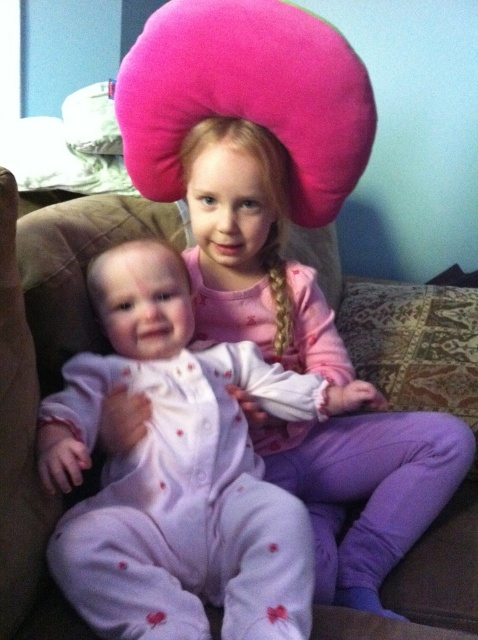
Question: Which point is farther to the camera?

Choices:
 (A) (125, 512)
 (B) (417, 416)

Answer: (B)

Question: Is matte pink pajamas at center above pink soft pajamas at center?

Choices:
 (A) no
 (B) yes

Answer: (A)

Question: Where is matte pink pajamas at center located in relation to pink soft pajamas at center in the image?

Choices:
 (A) below
 (B) above

Answer: (A)

Question: From the image, what is the correct spatial relationship of matte pink pajamas at center in relation to pink soft pajamas at center?

Choices:
 (A) left
 (B) right

Answer: (A)

Question: Which point is closer to the camera?

Choices:
 (A) (357, 499)
 (B) (166, 497)

Answer: (B)